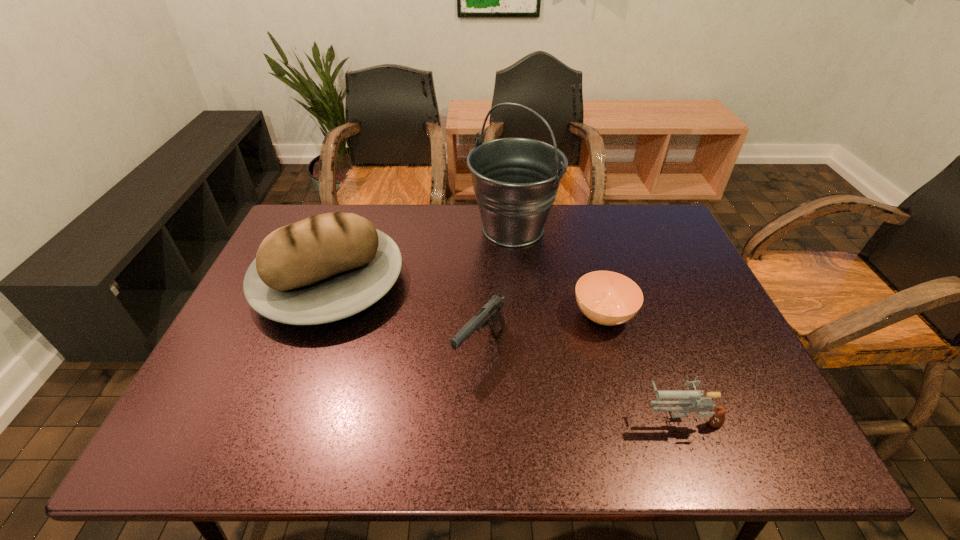
Identify the location of free space located at the barrel end of the right gun. [609, 418].

Image resolution: width=960 pixels, height=540 pixels. Find the location of `blank space located 0.320m at the barrel end of the right gun`. blank space located 0.320m at the barrel end of the right gun is located at coordinates (489, 418).

I want to click on vacant space positioned at the barrel end of the right gun, so click(x=455, y=418).

Locate an element on the screen. free space located 0.400m on the back of the shortest object is located at coordinates (574, 211).

Find the location of a particular element. bucket present at the far edge is located at coordinates (515, 180).

The image size is (960, 540). In order to click on bread that is at the far edge in this screenshot , I will do `click(327, 267)`.

You are a GUI agent. You are given a task and a screenshot of the screen. Output one action in this format:
    pyautogui.click(x=<x>, y=<y>)
    Task: Click on the object at the near edge
    The width and height of the screenshot is (960, 540).
    Given the screenshot: What is the action you would take?
    pyautogui.click(x=686, y=398)

I want to click on object located in the left edge section of the desktop, so click(327, 267).

This screenshot has height=540, width=960. Identify the location of object at the right edge. (686, 398).

The width and height of the screenshot is (960, 540). I want to click on object located at the far left corner, so click(327, 267).